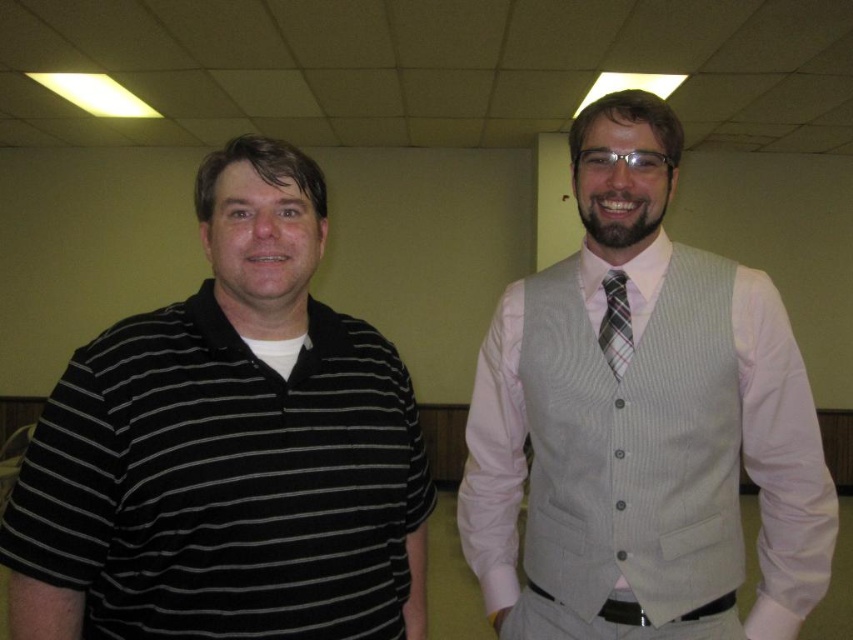
You are an assistant helping to organize a clothing store. You have two items to place on a rack. The items are the light gray textured vest at center and the light gray textured vest at right. Based on their positions in the image, which vest should you place on the left side of the rack to maintain the same spatial arrangement as shown?

The light gray textured vest at center should be placed on the left side of the rack because in the image, it is positioned to the left of the light gray textured vest at right, so maintaining that order would preserve the original arrangement.

You are a photographer setting up for a group photo. You notice the light gray textured vest at right and the plaid fabric tie at center. Which item is positioned farther to the right in the scene?

The light gray textured vest at right is positioned farther to the right than the plaid fabric tie at center.

You are organizing a clothing donation drive and need to categorize items by size. You have a light gray textured vest at right and a plaid fabric tie at center. Which item would require more space when packing?

The light gray textured vest at right is bigger than the plaid fabric tie at center, so it would require more space when packing.